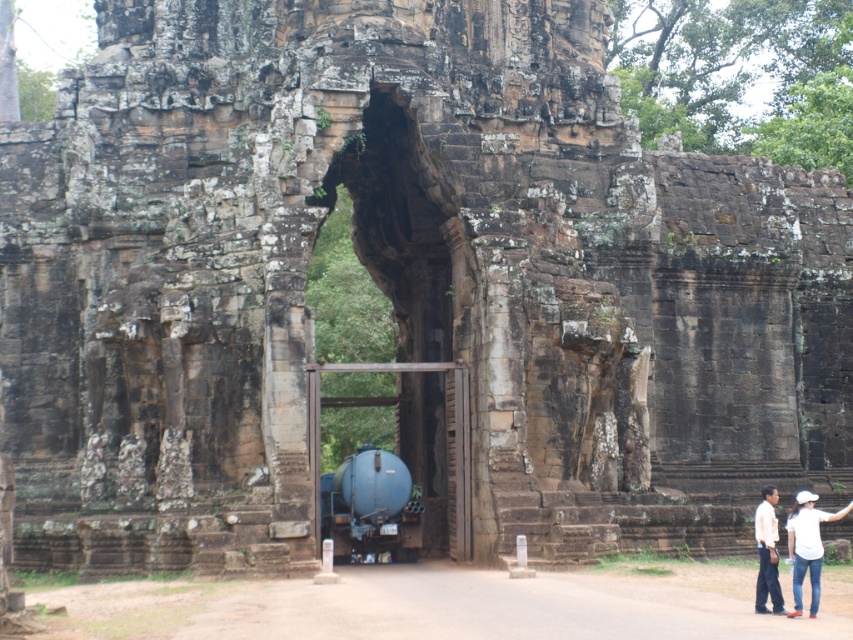
Question: Which object is positioned farthest from the white shirt at lower right?

Choices:
 (A) white cotton shirt at lower right
 (B) blue metallic tank at center

Answer: (B)

Question: Which of the following is the closest to the observer?

Choices:
 (A) white shirt at lower right
 (B) white cotton shirt at lower right

Answer: (B)

Question: Does blue metallic tank at center appear on the left side of white cotton shirt at lower right?

Choices:
 (A) no
 (B) yes

Answer: (B)

Question: Which object is positioned closest to the white cotton shirt at lower right?

Choices:
 (A) white shirt at lower right
 (B) blue metallic tank at center

Answer: (A)

Question: Is blue metallic tank at center to the left of white shirt at lower right from the viewer's perspective?

Choices:
 (A) yes
 (B) no

Answer: (A)

Question: Is white cotton shirt at lower right to the right of white shirt at lower right from the viewer's perspective?

Choices:
 (A) yes
 (B) no

Answer: (A)